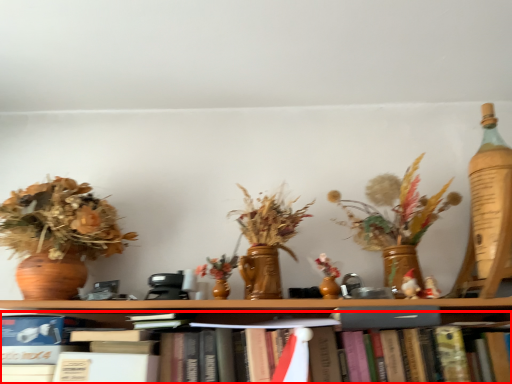
Question: Observing the image, what is the correct spatial positioning of book (annotated by the red box) in reference to paperback book?

Choices:
 (A) right
 (B) left

Answer: (B)